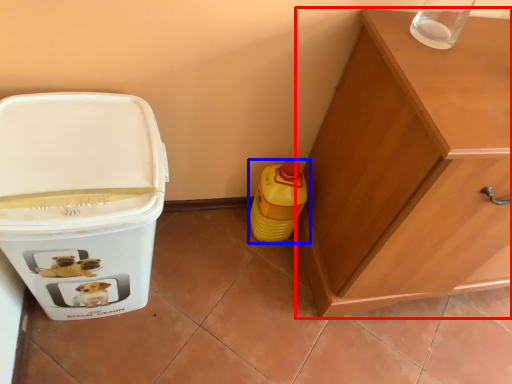
Question: Among these objects, which one is farthest to the camera, cabinetry (highlighted by a red box) or bottle (highlighted by a blue box)?

Choices:
 (A) cabinetry
 (B) bottle

Answer: (B)